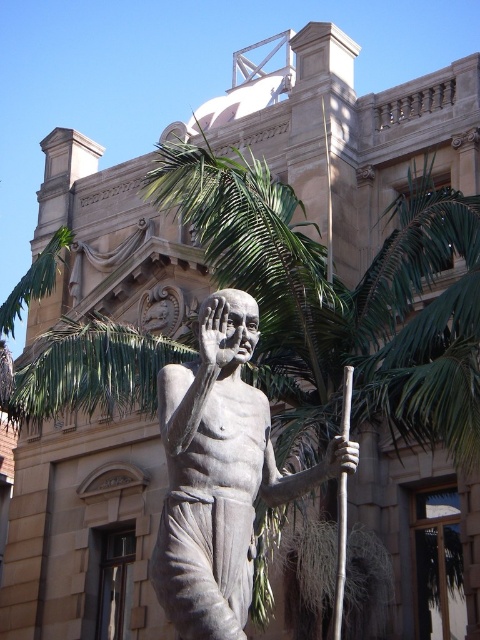
Is bronze statue at center taller than brown wood pole at center?

Correct, bronze statue at center is much taller as brown wood pole at center.

Can you confirm if bronze statue at center is shorter than brown wood pole at center?

No, bronze statue at center is not shorter than brown wood pole at center.

Does point (240, 467) come farther from viewer compared to point (344, 401)?

That is False.

This screenshot has height=640, width=480. I want to click on bronze statue at center, so click(x=219, y=474).